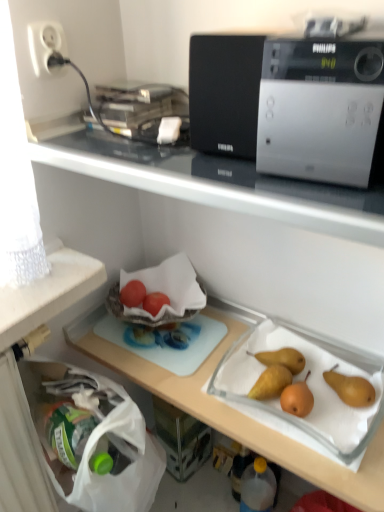
Question: Considering the relative sizes of silver metallic microwave at upper center and matte red tomato at center-left, the 2th fruit from the right, in the image provided, is silver metallic microwave at upper center wider than matte red tomato at center-left, the 2th fruit from the right,?

Choices:
 (A) yes
 (B) no

Answer: (A)

Question: Considering the relative sizes of silver metallic microwave at upper center and matte red tomato at center-left, the 2th fruit from the right, in the image provided, is silver metallic microwave at upper center smaller than matte red tomato at center-left, the 2th fruit from the right,?

Choices:
 (A) yes
 (B) no

Answer: (B)

Question: Is silver metallic microwave at upper center bigger than matte red tomato at center-left, the 2th fruit from the right?

Choices:
 (A) yes
 (B) no

Answer: (A)

Question: Does silver metallic microwave at upper center appear on the left side of matte red tomato at center-left, the 2th fruit from the right?

Choices:
 (A) yes
 (B) no

Answer: (B)

Question: Can you confirm if silver metallic microwave at upper center is taller than matte red tomato at center-left, the 2th fruit from the right?

Choices:
 (A) no
 (B) yes

Answer: (B)

Question: Is silver metallic microwave at upper center inside the boundaries of transparent plastic bottle at lower center, or outside?

Choices:
 (A) inside
 (B) outside

Answer: (B)

Question: Relative to transparent plastic bottle at lower center, is silver metallic microwave at upper center in front or behind?

Choices:
 (A) front
 (B) behind

Answer: (A)

Question: Is point (269, 109) closer or farther from the camera than point (258, 510)?

Choices:
 (A) closer
 (B) farther

Answer: (A)

Question: In terms of width, does silver metallic microwave at upper center look wider or thinner when compared to transparent plastic bottle at lower center?

Choices:
 (A) wide
 (B) thin

Answer: (A)

Question: In terms of size, does silver metallic microwave at upper center appear bigger or smaller than matte red tomato at center-left, the 1th fruit positioned from the left?

Choices:
 (A) big
 (B) small

Answer: (A)

Question: Is silver metallic microwave at upper center spatially inside matte red tomato at center-left, the 1th fruit positioned from the left, or outside of it?

Choices:
 (A) outside
 (B) inside

Answer: (A)

Question: From the image's perspective, is silver metallic microwave at upper center located above or below matte red tomato at center-left, the 1th fruit positioned from the left?

Choices:
 (A) below
 (B) above

Answer: (B)

Question: Is silver metallic microwave at upper center wider or thinner than matte red tomato at center-left, the 1th fruit positioned from the left?

Choices:
 (A) wide
 (B) thin

Answer: (A)

Question: From the image's perspective, is silver metallic microwave at upper center above or below white plastic socket at upper left?

Choices:
 (A) below
 (B) above

Answer: (A)

Question: Considering the positions of silver metallic microwave at upper center and white plastic socket at upper left in the image, is silver metallic microwave at upper center bigger or smaller than white plastic socket at upper left?

Choices:
 (A) big
 (B) small

Answer: (A)